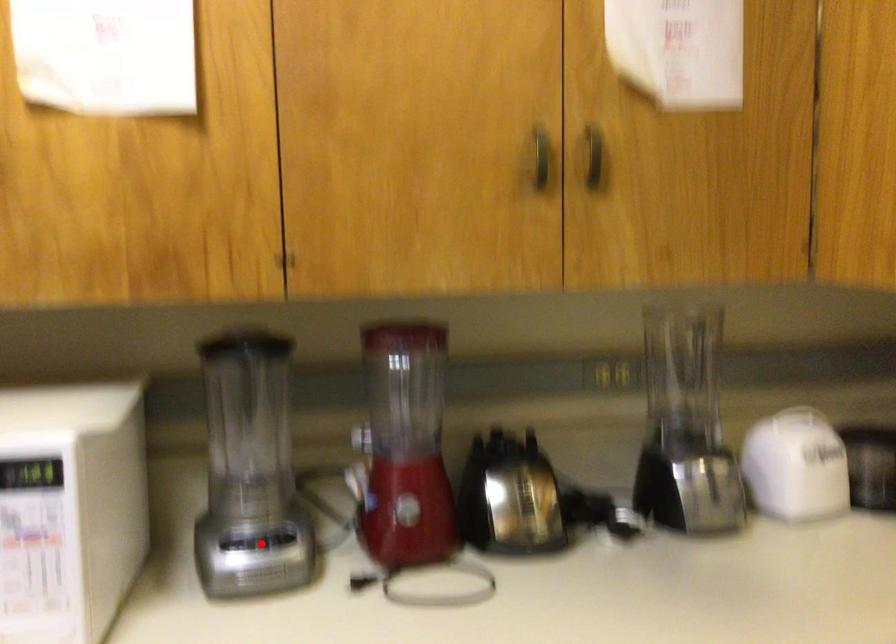
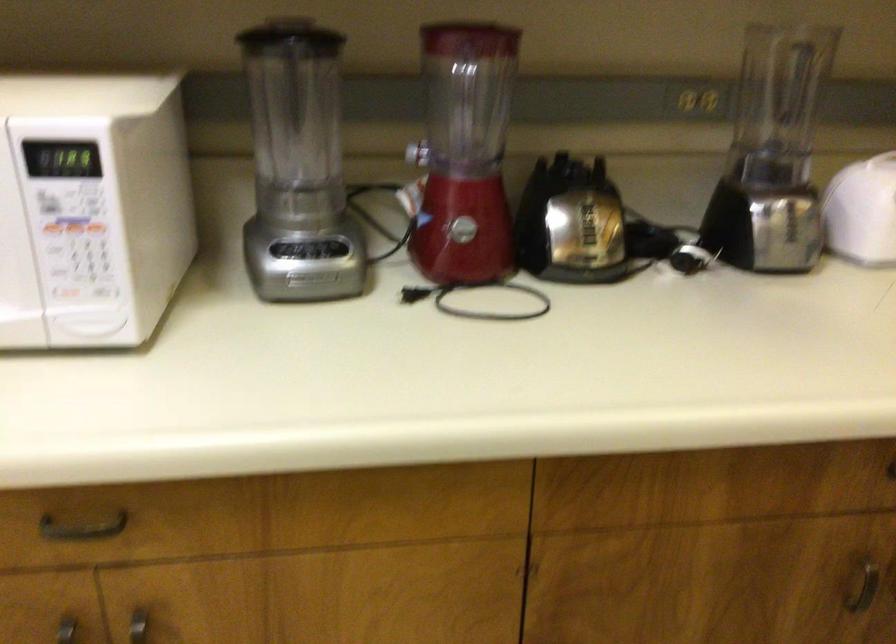
In the second image, find the point that corresponds to the highlighted location in the first image.

(308, 249)